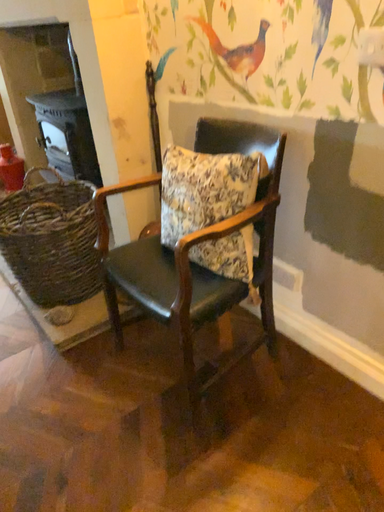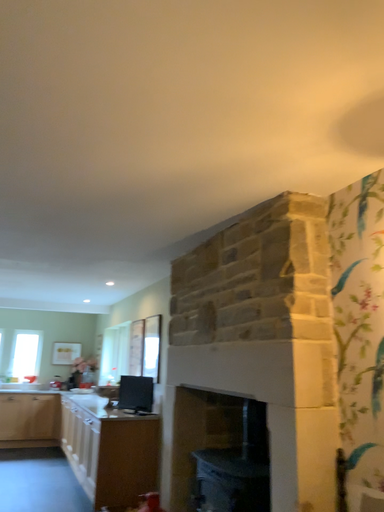
Question: Which way did the camera rotate in the video?

Choices:
 (A) rotated downward
 (B) rotated upward

Answer: (B)